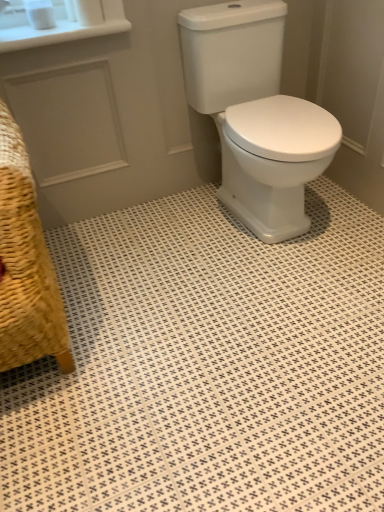
The height and width of the screenshot is (512, 384). In order to click on free area in between woven straw armchair at lower left and white glossy porcelain at center in this screenshot , I will do 171,270.